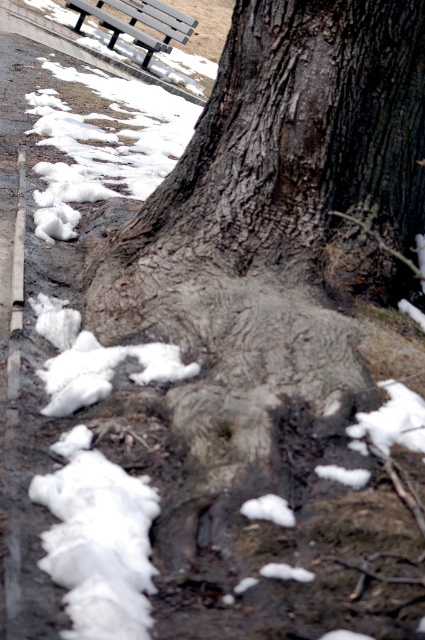
You are a photographer trying to capture the gray rough bark tree at center and the white fluffy snow at lower left in a single shot. Since the camera can only focus on one subject at a time, which subject should you prioritize focusing on to ensure it appears larger in the photo?

The gray rough bark tree at center is taller than the white fluffy snow at lower left, so you should prioritize focusing on the gray rough bark tree at center to ensure it appears larger in the photo.

You are planning to place a 10 feet long wooden bench between the white fluffy snow at lower left and the metallic gray bench at upper left. Will there be enough space for the wooden bench to fit between them?

The distance between the white fluffy snow at lower left and the metallic gray bench at upper left is 30.74 feet. Since the wooden bench is only 10 feet long, there is sufficient space for it to fit between them.